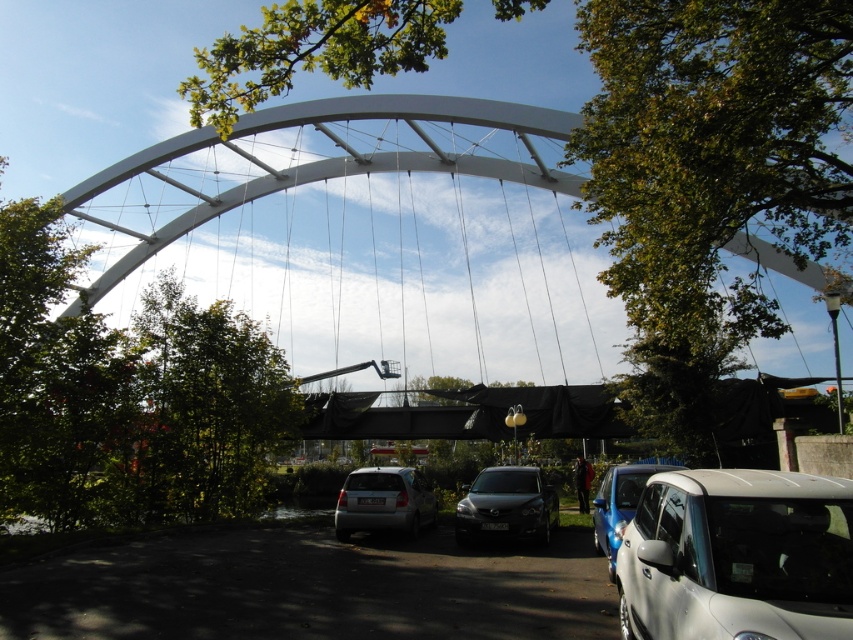
You are standing at the base of the bridge and want to take a photo of the green leafy tree at center. According to the coordinates provided, where should you position yourself to capture the tree in the center of your camera frame?

The green leafy tree at center is located at coordinates point (708, 173), so you should position yourself at the base of the bridge facing towards the coordinates point (708, 173) to capture the tree in the center of your camera frame.

You are standing on the bridge and looking towards the trees. There are two points marked on the bridge structure, one at point coordinates point (376, 12) and another at point (503, 525). Which point is closer to you when you look towards the trees?

Point (376, 12) is in front of point (503, 525), so it is closer to you when looking towards the trees.